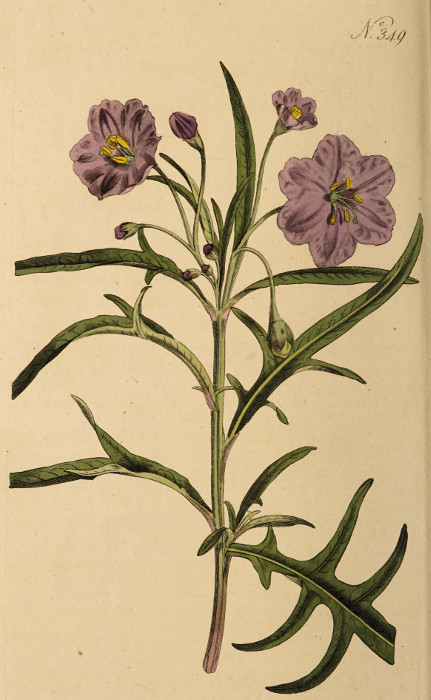
Where is `empty space below plant`? empty space below plant is located at coordinates (x=67, y=636).